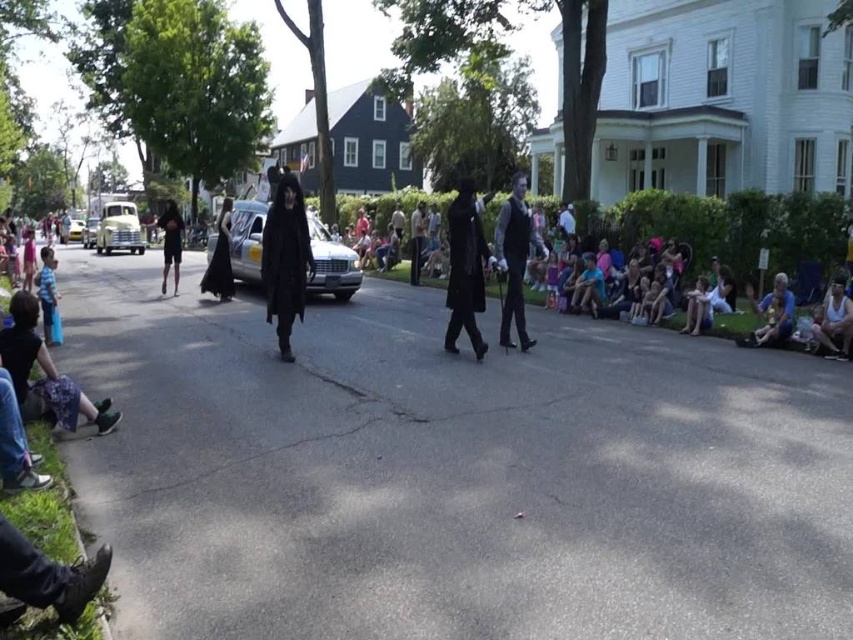
You are a pedestrian standing on the street and see the metallic silver hearse at center and the matte black vest at center. Which object is bigger in size?

The metallic silver hearse at center is larger in size compared to the matte black vest at center.